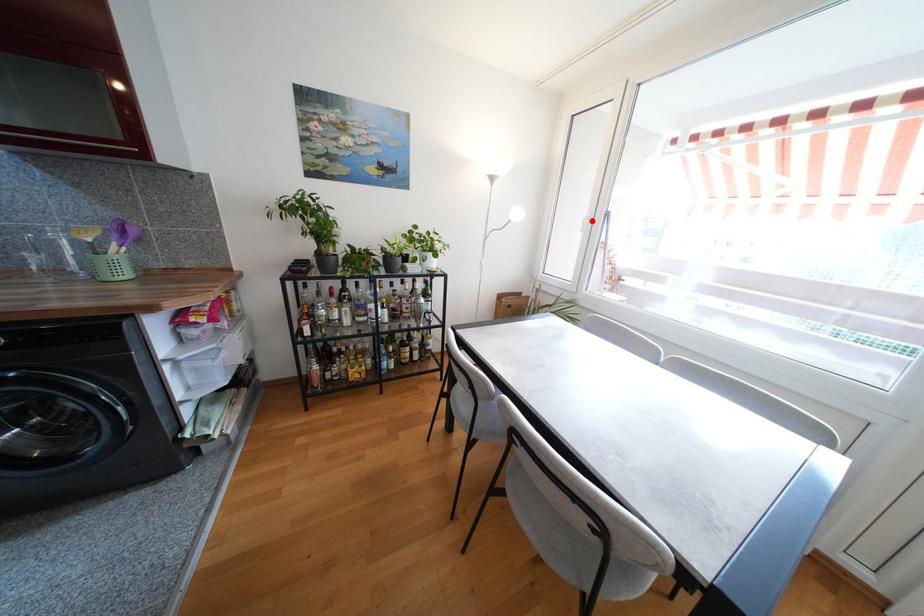
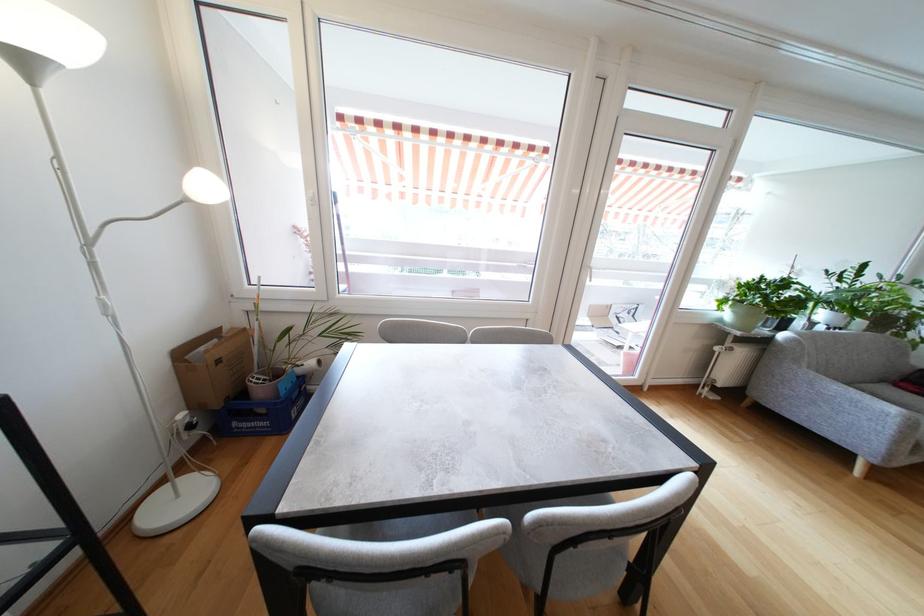
Locate, in the second image, the point that corresponds to the highlighted location in the first image.

(315, 201)